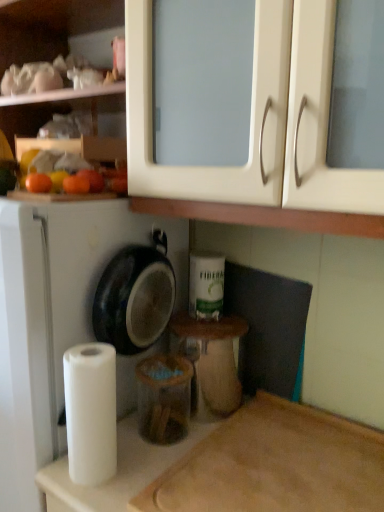
Question: From the image's perspective, is white matte paper towel at lower left below white matte dish washer at left?

Choices:
 (A) no
 (B) yes

Answer: (A)

Question: From the image's perspective, is white matte paper towel at lower left on white matte dish washer at left?

Choices:
 (A) yes
 (B) no

Answer: (A)

Question: Can you confirm if white matte paper towel at lower left is thinner than white matte dish washer at left?

Choices:
 (A) no
 (B) yes

Answer: (B)

Question: From a real-world perspective, is white matte paper towel at lower left positioned over white matte dish washer at left based on gravity?

Choices:
 (A) yes
 (B) no

Answer: (A)

Question: Can you confirm if white matte paper towel at lower left is taller than white matte dish washer at left?

Choices:
 (A) yes
 (B) no

Answer: (B)

Question: Does point (182, 323) appear closer or farther from the camera than point (221, 306)?

Choices:
 (A) closer
 (B) farther

Answer: (A)

Question: From a real-world perspective, relative to white matte toilet paper at center, is matte plastic container at center vertically above or below?

Choices:
 (A) below
 (B) above

Answer: (A)

Question: In terms of width, does matte plastic container at center look wider or thinner when compared to white matte toilet paper at center?

Choices:
 (A) wide
 (B) thin

Answer: (A)

Question: In terms of size, does matte plastic container at center appear bigger or smaller than white matte toilet paper at center?

Choices:
 (A) small
 (B) big

Answer: (B)

Question: Considering the positions of orange matte at left, which ranks as the second orange in left-to-right order, and white matte toilet paper at center in the image, is orange matte at left, which ranks as the second orange in left-to-right order, wider or thinner than white matte toilet paper at center?

Choices:
 (A) thin
 (B) wide

Answer: (A)

Question: From a real-world perspective, is orange matte at left, arranged as the first orange when viewed from the right, positioned above or below white matte toilet paper at center?

Choices:
 (A) below
 (B) above

Answer: (B)

Question: Is orange matte at left, arranged as the first orange when viewed from the right, bigger or smaller than white matte toilet paper at center?

Choices:
 (A) big
 (B) small

Answer: (B)

Question: Is orange matte at left, arranged as the first orange when viewed from the right, inside the boundaries of white matte toilet paper at center, or outside?

Choices:
 (A) inside
 (B) outside

Answer: (B)

Question: Is matte plastic container at center bigger or smaller than white matte dish washer at left?

Choices:
 (A) small
 (B) big

Answer: (A)

Question: Is point (231, 338) positioned closer to the camera than point (142, 224)?

Choices:
 (A) closer
 (B) farther

Answer: (B)